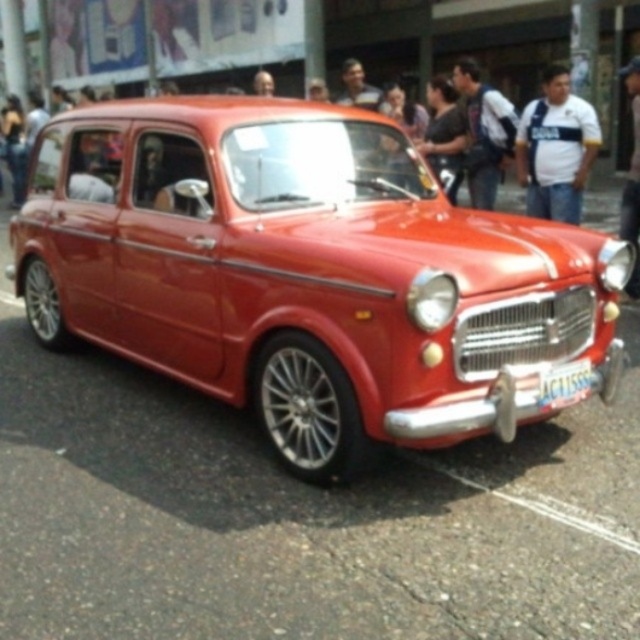
You are a photographer trying to capture a clear shot of the vintage red car. However, there are two people in the foreground wearing a white striped shirt at center and a dark blue shirt at center. Which person is blocking your view more of the car?

The white striped shirt at center is positioned over dark blue shirt at center, so the person in the white striped shirt at center is closer to the camera and blocking more of the view of the vintage red car.

You are a photographer trying to capture the vintage red car and the crowd. You notice two people in the crowd wearing a white striped shirt at center and a dark blue shirt at center. Which person is standing to the right of the other?

The white striped shirt at center is positioned on the right side of dark blue shirt at center.

In the scene shown: You are a photographer standing at the camera position. You want to take a photo of the vintage red car and the dark blue shirt at center. Can you include both in the same frame without moving the camera?

The dark blue shirt at center is 4.90 meters from the camera. Since the vintage red car is parked on the street and the shirt is part of the crowd in the background, they are both within the same line of sight. Therefore, you can include both in the same frame without moving the camera.